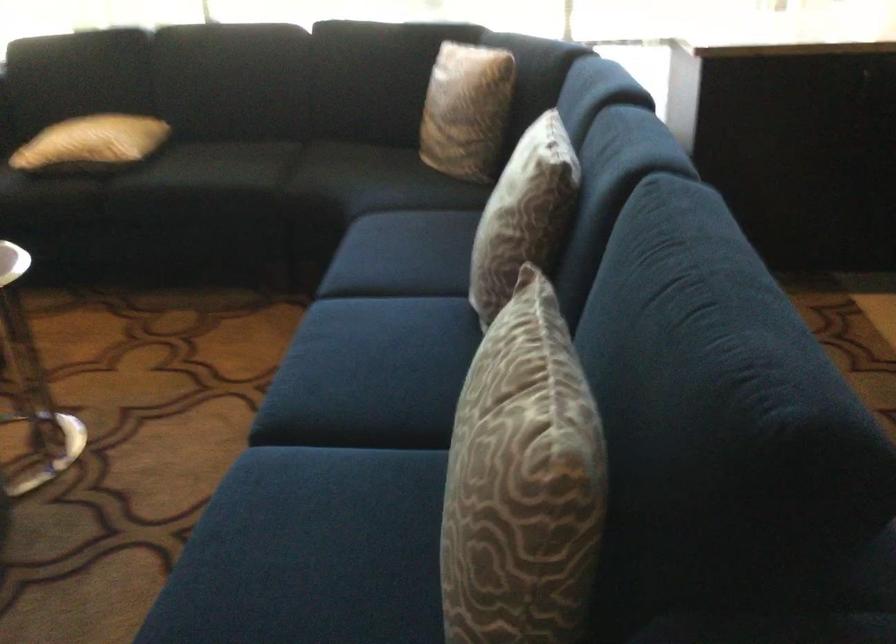
What do you see at coordinates (82, 64) in the screenshot? I see `a sofa armrest` at bounding box center [82, 64].